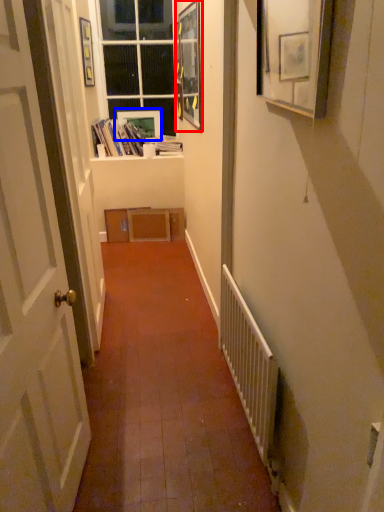
Question: Which object appears farthest to the camera in this image, picture frame (highlighted by a red box) or picture frame (highlighted by a blue box)?

Choices:
 (A) picture frame
 (B) picture frame

Answer: (B)